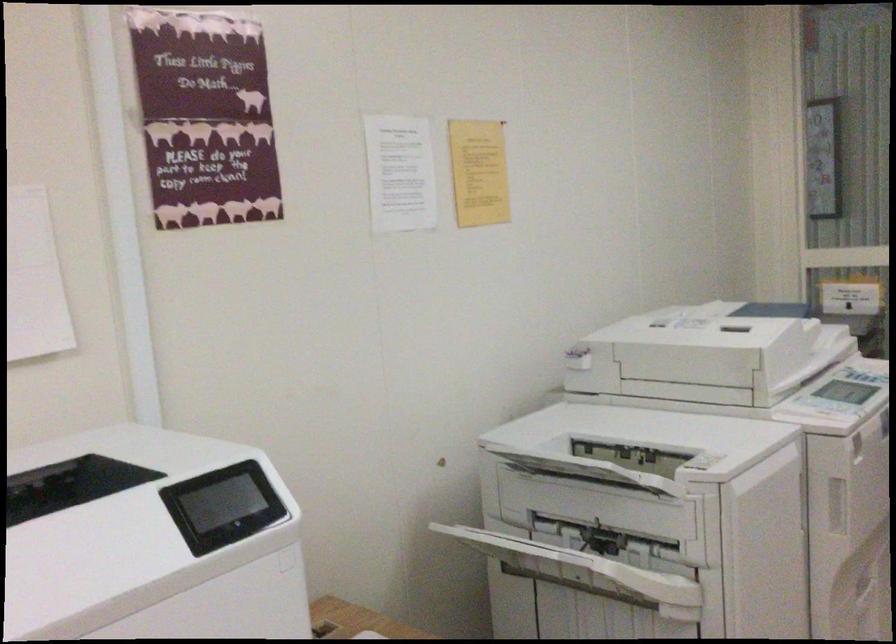
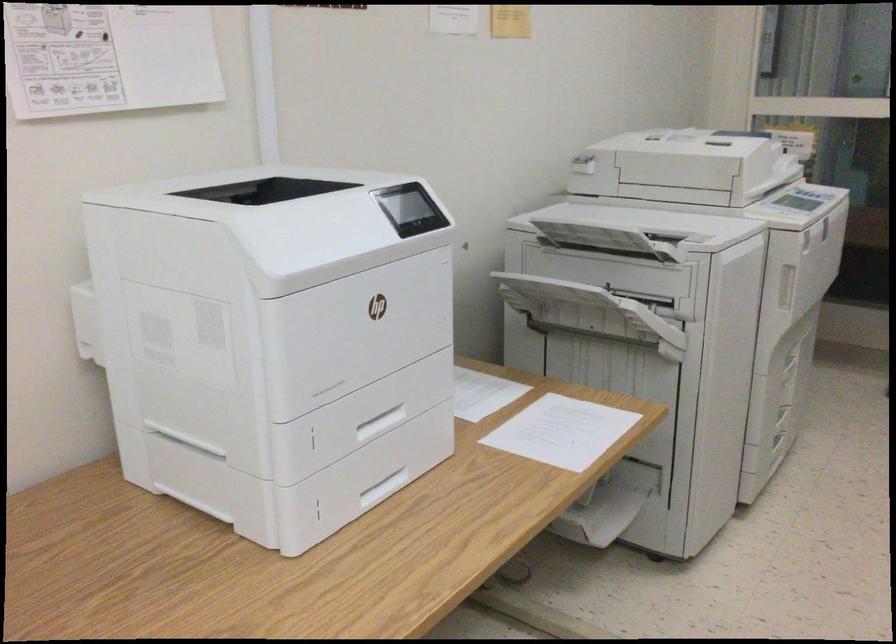
Where in the second image is the point corresponding to the point at 616,509 from the first image?

(623, 270)